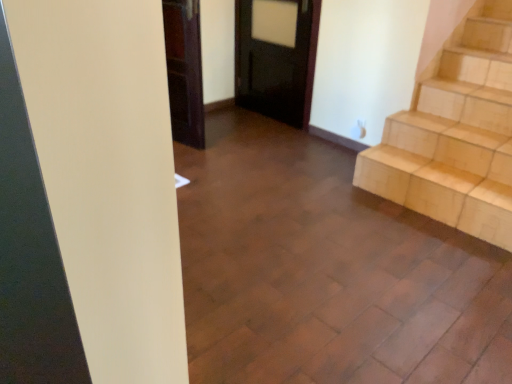
Measure the distance between dark wood door at center and camera.

A distance of 10.66 feet exists between dark wood door at center and camera.

Describe the element at coordinates (277, 65) in the screenshot. I see `dark wood door at center` at that location.

Locate an element on the screen. dark wood door at center is located at coordinates (277, 65).

Find the location of `dark wood door at center`. dark wood door at center is located at coordinates (277, 65).